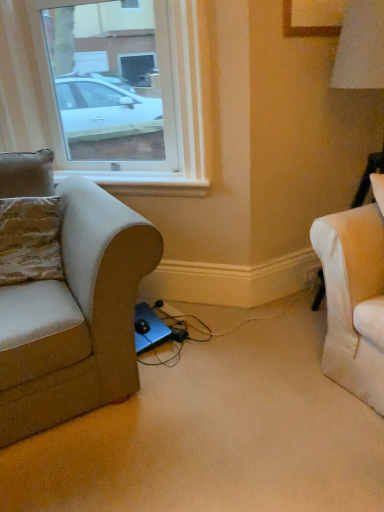
The width and height of the screenshot is (384, 512). What are the coordinates of `vacant area that is situated to the right of matte beige couch at left` in the screenshot? It's located at pos(247,391).